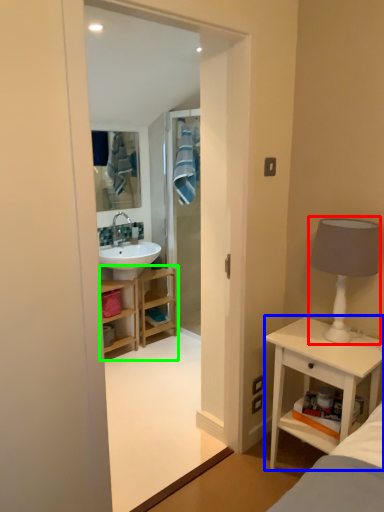
Question: Which is nearer to the table lamp (highlighted by a red box)? nightstand (highlighted by a blue box) or bathroom cabinet (highlighted by a green box).

Choices:
 (A) nightstand
 (B) bathroom cabinet

Answer: (A)